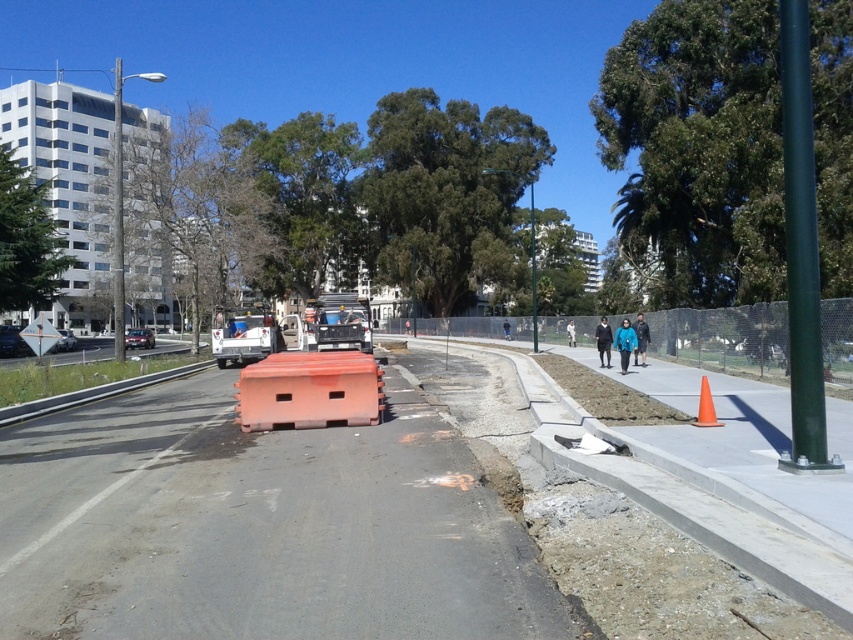
You are a delivery driver who needs to navigate through the construction site shown. You see the orange plastic barrier at center and the brushed metal highway at lower left. Which object is shorter in height?

The orange plastic barrier at center is shorter than the brushed metal highway at lower left.

You are a delivery drone flying over an urban construction site. You need to navigate between two points marked as point (1, 358) and point (705, 406). According to the scene, which point is closer to the construction site?

Point (1, 358) is behind point (705, 406), so the closer point to the construction site would be point (705, 406) since it is in front.

You are a delivery driver approaching the construction site. You see the orange plastic barrier at center and the orange plastic barricade at center. Which one is shorter?

The orange plastic barrier at center is shorter than the orange plastic barricade at center.